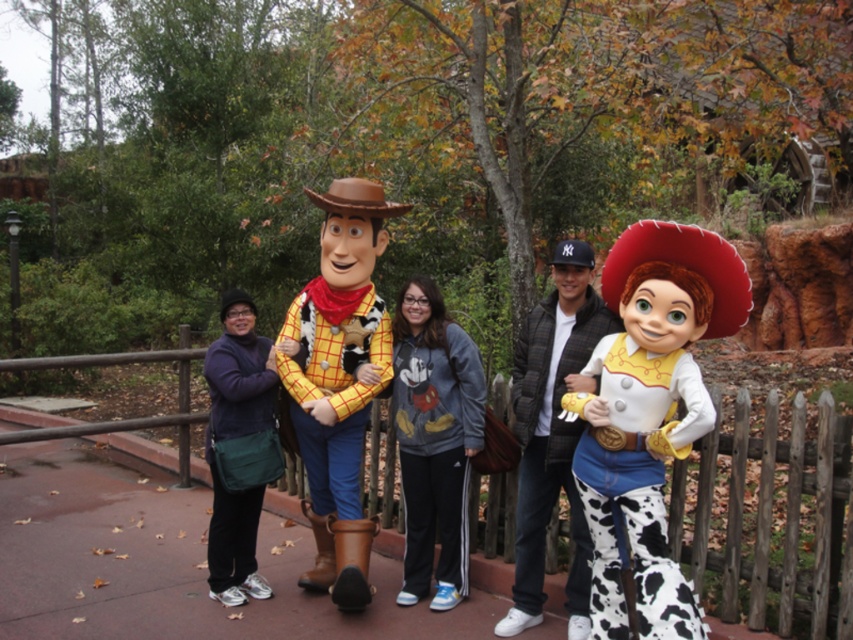
You are a photographer at the theme park and need to ensure both the cowprint fabric cowboy at center and the gray fleece sweatshirt at center are clearly visible in your photo. Given their sizes, which one might require you to adjust your camera angle to avoid being too dominant in the frame?

The cowprint fabric cowboy at center is bigger than the gray fleece sweatshirt at center, so you should adjust the camera angle to prevent the cowprint fabric cowboy at center from overshadowing the smaller gray fleece sweatshirt at center.

You are a photographer trying to capture a clear shot of both the cow print fabric cowboy hat at right and the matte yellow shirt at center. Since you can only focus on one object at a time, which one should you focus on first to ensure the other remains in the background?

The cow print fabric cowboy hat at right is closer to the viewer than the matte yellow shirt at center, so focus on the cow print fabric cowboy hat at right first. This way, the matte yellow shirt at center will naturally stay in the background.